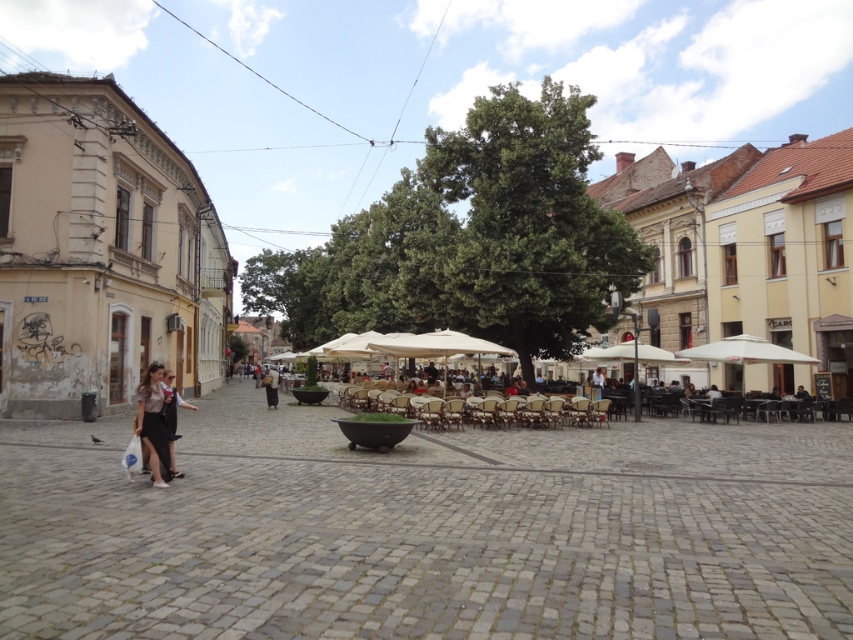
Consider the image. Can you confirm if matte black jacket at lower left is positioned to the right of dark brown leather jacket at center?

Correct, you'll find matte black jacket at lower left to the right of dark brown leather jacket at center.

Who is shorter, matte black jacket at lower left or dark brown leather jacket at center?

With less height is dark brown leather jacket at center.

What do you see at coordinates (172, 417) in the screenshot? The height and width of the screenshot is (640, 853). I see `matte black jacket at lower left` at bounding box center [172, 417].

Where is `matte black jacket at lower left`? Image resolution: width=853 pixels, height=640 pixels. matte black jacket at lower left is located at coordinates (172, 417).

Can you confirm if matte black dress at lower left is smaller than white fabric umbrella at center?

Yes, matte black dress at lower left is smaller than white fabric umbrella at center.

Does matte black dress at lower left come in front of white fabric umbrella at center?

That is True.

Which is in front, point (166, 452) or point (468, 339)?

Positioned in front is point (166, 452).

Locate an element on the screen. This screenshot has width=853, height=640. matte black dress at lower left is located at coordinates (154, 424).

Can you confirm if matte black dress at lower left is positioned to the left of dark brown leather jacket at center?

In fact, matte black dress at lower left is to the right of dark brown leather jacket at center.

Is point (138, 419) behind point (267, 376)?

No, it is in front of (267, 376).

Between point (143, 426) and point (276, 376), which one is positioned behind?

The point (276, 376) is more distant.

You are a GUI agent. You are given a task and a screenshot of the screen. Output one action in this format:
    pyautogui.click(x=<x>, y=<y>)
    Task: Click on the matte black dress at lower left
    The image size is (853, 640).
    Given the screenshot: What is the action you would take?
    pyautogui.click(x=154, y=424)